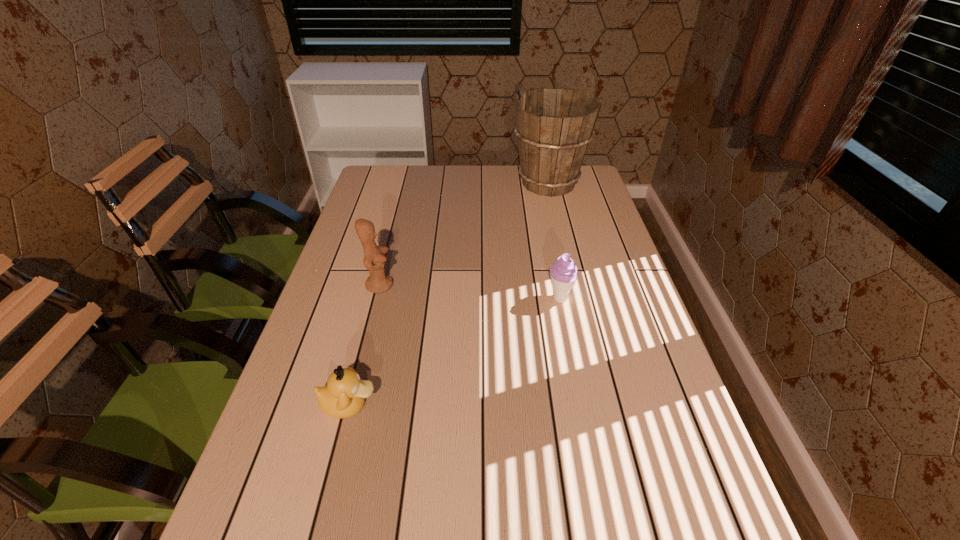
Locate an element on the screen. The width and height of the screenshot is (960, 540). object that is the third nearest to the second shortest object is located at coordinates (343, 397).

Identify the location of object that is the nearest to the duckling. Image resolution: width=960 pixels, height=540 pixels. (378, 282).

Find the location of a particular element. This screenshot has width=960, height=540. blank area in the image that satisfies the following two spatial constraints: 1. on the front-facing side of the figurine; 2. on the left side of the icecream is located at coordinates (376, 299).

Where is `vacant area that satisfies the following two spatial constraints: 1. on the front side of the icecream; 2. on the face of the shortest object`? The width and height of the screenshot is (960, 540). vacant area that satisfies the following two spatial constraints: 1. on the front side of the icecream; 2. on the face of the shortest object is located at coordinates (581, 405).

Find the location of a particular element. This screenshot has height=540, width=960. free space that satisfies the following two spatial constraints: 1. on the back side of the third tallest object; 2. on the left side of the farthest object is located at coordinates (537, 184).

The image size is (960, 540). Identify the location of blank space that satisfies the following two spatial constraints: 1. on the front side of the bucket; 2. on the front-facing side of the figurine. (572, 285).

This screenshot has width=960, height=540. I want to click on blank space that satisfies the following two spatial constraints: 1. on the front-facing side of the icecream; 2. on the right side of the figurine, so click(376, 299).

The image size is (960, 540). Identify the location of free space that satisfies the following two spatial constraints: 1. on the front-facing side of the second shortest object; 2. on the right side of the second tallest object. (376, 299).